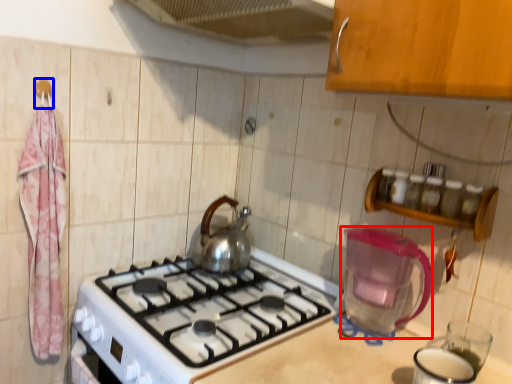
Question: Which of the following is the closest to the observer, appliance (highlighted by a red box) or hanger (highlighted by a blue box)?

Choices:
 (A) appliance
 (B) hanger

Answer: (A)